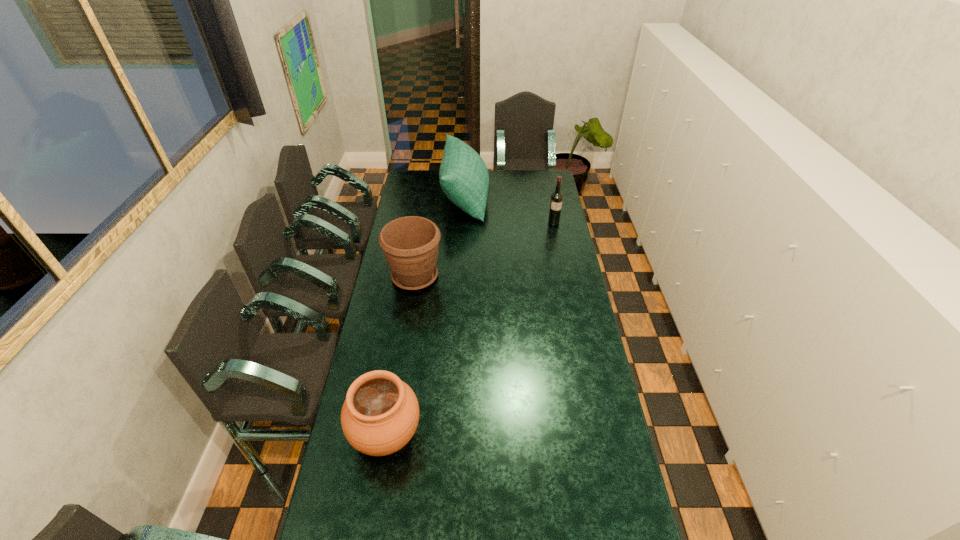
The height and width of the screenshot is (540, 960). Find the location of `cushion`. cushion is located at coordinates (464, 179).

Where is `wine bottle`? wine bottle is located at coordinates (556, 198).

The image size is (960, 540). What are the coordinates of `flowerpot` in the screenshot? It's located at (410, 244).

Locate an element on the screen. The height and width of the screenshot is (540, 960). the nearest object is located at coordinates (380, 414).

I want to click on free region located on the front-facing side of the cushion, so click(508, 198).

This screenshot has height=540, width=960. Identify the location of vacant space located on the front and back of the wine bottle. (556, 234).

Locate an element on the screen. vacant space located 0.120m on the back of the flowerpot is located at coordinates (420, 243).

Identify the location of blank space located on the front of the nearest object. (371, 533).

Where is `object situated at the far edge`? This screenshot has width=960, height=540. object situated at the far edge is located at coordinates (464, 179).

Where is `flowerpot that is positioned at the left edge`? The width and height of the screenshot is (960, 540). flowerpot that is positioned at the left edge is located at coordinates (410, 244).